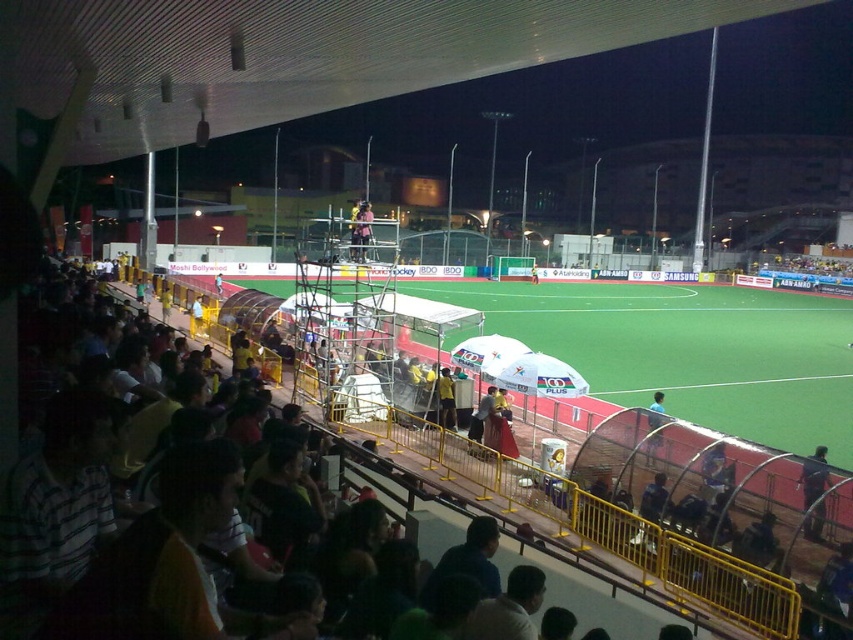
You are a field hockey player standing on the green artificial turf at center. You want to pass the ball to a teammate wearing the matte pink shirt at center. Can you make a direct pass without needing to stop or change direction?

The green artificial turf at center and matte pink shirt at center are 29.48 meters apart. In field hockey, the maximum allowable passing distance without stopping or changing direction is 25 meters. Therefore, the player cannot make a direct pass to the teammate wearing the matte pink shirt at center without violating the rules.

You are a photographer positioned at the edge of the field. You want to capture a photo that includes both the green artificial turf at center and the dark blue uniform at center. Which object should you focus on first to ensure both are in frame?

The green artificial turf at center is much taller than the dark blue uniform at center, so you should focus on the green artificial turf at center first to ensure both are in frame.